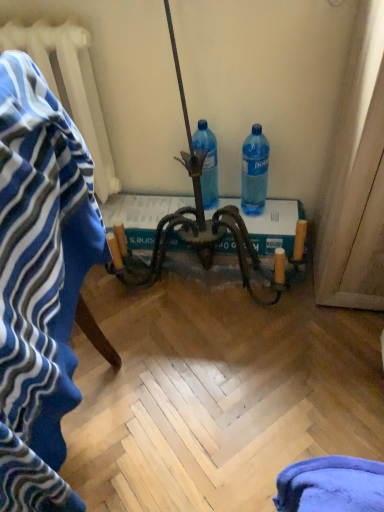
Question: Is transparent plastic bottle at right, positioned as the first bottle in right-to-left order, thinner than blue striped bath towel at left?

Choices:
 (A) yes
 (B) no

Answer: (A)

Question: From a real-world perspective, is transparent plastic bottle at right, positioned as the first bottle in right-to-left order, physically above blue striped bath towel at left?

Choices:
 (A) no
 (B) yes

Answer: (A)

Question: Considering the relative sizes of transparent plastic bottle at right, positioned as the first bottle in right-to-left order, and blue striped bath towel at left in the image provided, is transparent plastic bottle at right, positioned as the first bottle in right-to-left order, taller than blue striped bath towel at left?

Choices:
 (A) yes
 (B) no

Answer: (B)

Question: From a real-world perspective, does transparent plastic bottle at right, the 2th bottle viewed from the left, sit lower than blue striped bath towel at left?

Choices:
 (A) yes
 (B) no

Answer: (A)

Question: Is transparent plastic bottle at right, positioned as the first bottle in right-to-left order, oriented towards blue striped bath towel at left?

Choices:
 (A) yes
 (B) no

Answer: (B)

Question: From the image's perspective, is transparent plastic bottle at right, the 2th bottle viewed from the left, beneath blue striped bath towel at left?

Choices:
 (A) yes
 (B) no

Answer: (B)

Question: Is blue plastic bottle at center, which is the 2th bottle from right to left, a part of transparent plastic bottle at right, the 2th bottle viewed from the left?

Choices:
 (A) yes
 (B) no

Answer: (B)

Question: From the image's perspective, is transparent plastic bottle at right, the 2th bottle viewed from the left, under blue plastic bottle at center, which is counted as the first bottle, starting from the left?

Choices:
 (A) yes
 (B) no

Answer: (A)

Question: Considering the relative sizes of transparent plastic bottle at right, the 2th bottle viewed from the left, and blue plastic bottle at center, which is the 2th bottle from right to left, in the image provided, is transparent plastic bottle at right, the 2th bottle viewed from the left, taller than blue plastic bottle at center, which is the 2th bottle from right to left,?

Choices:
 (A) no
 (B) yes

Answer: (B)

Question: Is transparent plastic bottle at right, the 2th bottle viewed from the left, closer to camera compared to blue plastic bottle at center, which is the 2th bottle from right to left?

Choices:
 (A) yes
 (B) no

Answer: (A)

Question: Is transparent plastic bottle at right, the 2th bottle viewed from the left, oriented towards blue plastic bottle at center, which is counted as the first bottle, starting from the left?

Choices:
 (A) no
 (B) yes

Answer: (A)

Question: From a real-world perspective, is transparent plastic bottle at right, the 2th bottle viewed from the left, on blue plastic bottle at center, which is counted as the first bottle, starting from the left?

Choices:
 (A) yes
 (B) no

Answer: (A)

Question: From a real-world perspective, is blue plastic bottle at center, which is counted as the first bottle, starting from the left, positioned under white textured radiator at upper left based on gravity?

Choices:
 (A) yes
 (B) no

Answer: (A)